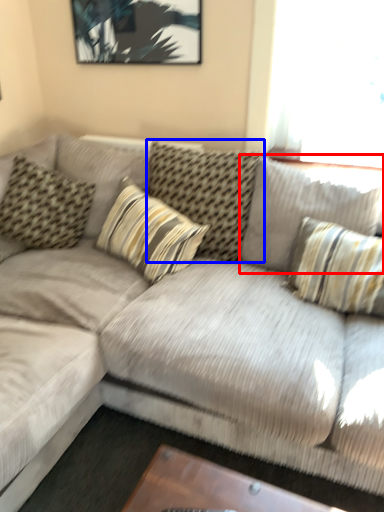
Question: Which of the following is the farthest to the observer, pillow (highlighted by a red box) or pillow (highlighted by a blue box)?

Choices:
 (A) pillow
 (B) pillow

Answer: (B)